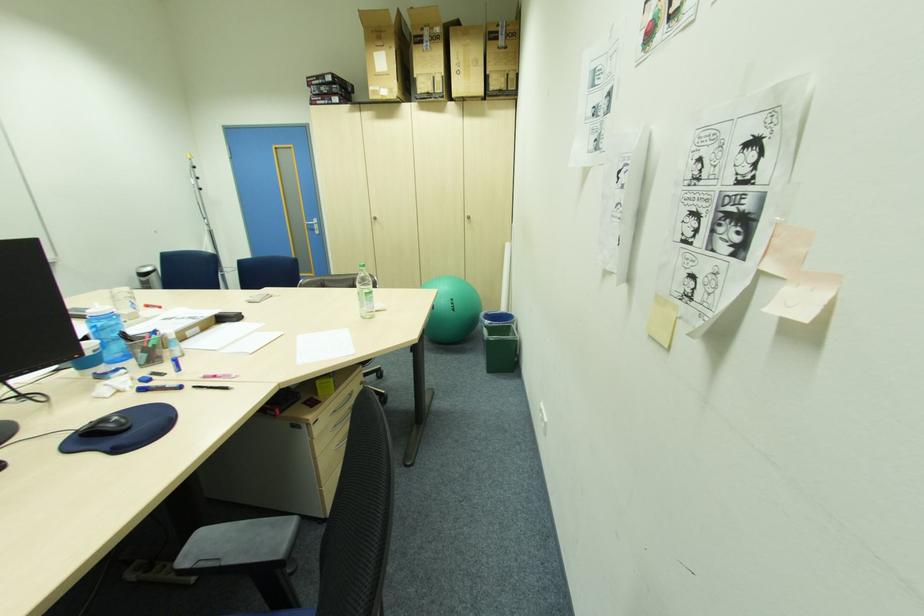
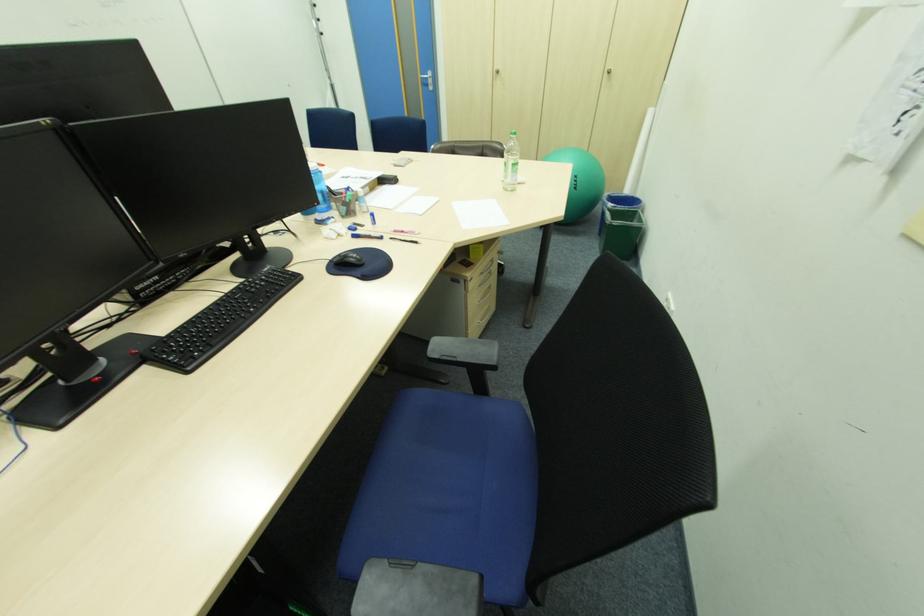
Where in the second image is the point corresponding to [312,419] from the first image?

(472, 277)